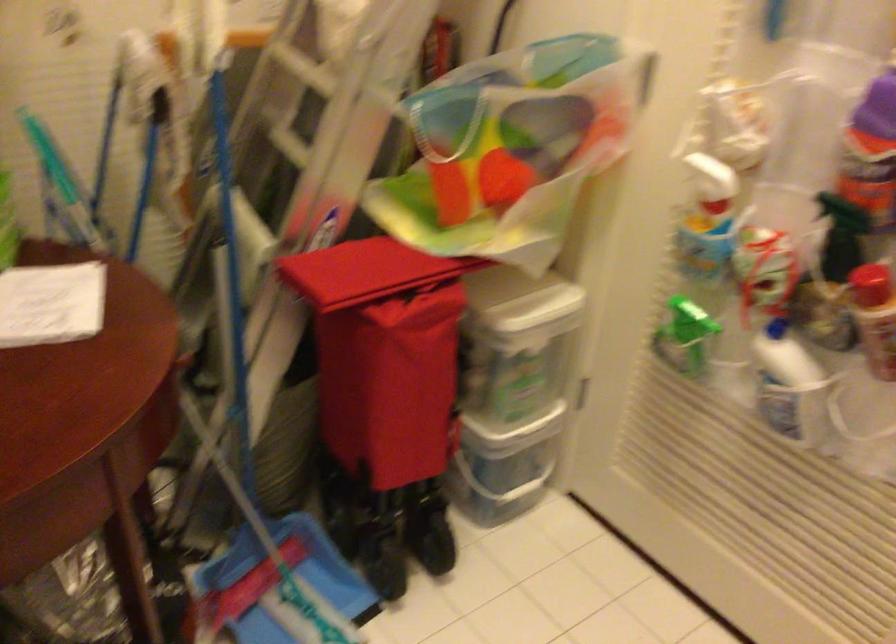
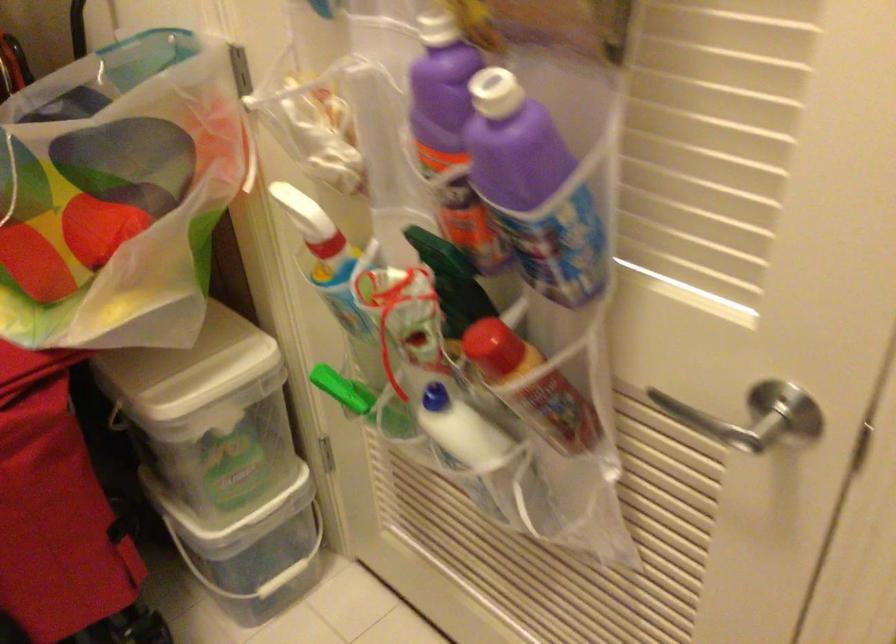
In a continuous first-person perspective shot, in which direction is the camera moving?

The movement direction of the cameraman is right, forward.